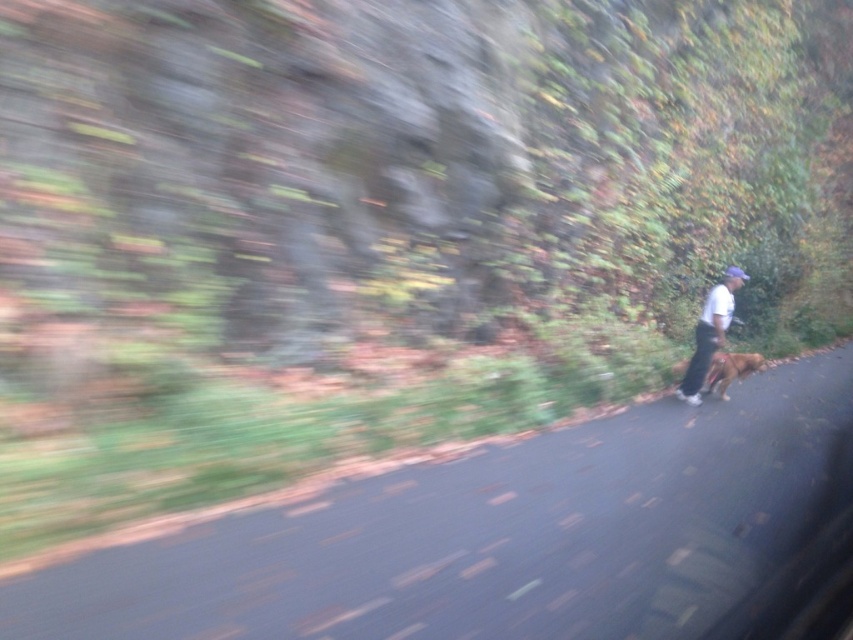
Question: Which of the following is the farthest from the observer?

Choices:
 (A) white matte shirt at center
 (B) brown furry dog at right

Answer: (B)

Question: From the image, what is the correct spatial relationship of white matte shirt at center in relation to brown furry dog at right?

Choices:
 (A) left
 (B) right

Answer: (A)

Question: Is white matte shirt at center to the right of brown furry dog at right from the viewer's perspective?

Choices:
 (A) no
 (B) yes

Answer: (A)

Question: Is white matte shirt at center above brown furry dog at right?

Choices:
 (A) no
 (B) yes

Answer: (B)